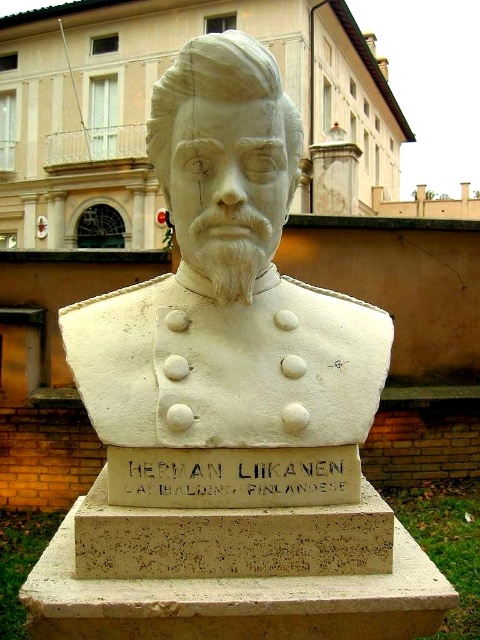
Is white marble bust at center to the left of gold metallic plaque at center from the viewer's perspective?

No, white marble bust at center is not to the left of gold metallic plaque at center.

Is white marble bust at center closer to the viewer compared to gold metallic plaque at center?

Yes, it is.

Is point (326, 406) more distant than point (239, 477)?

Yes, it is behind point (239, 477).

Where is `white marble bust at center`? white marble bust at center is located at coordinates (227, 285).